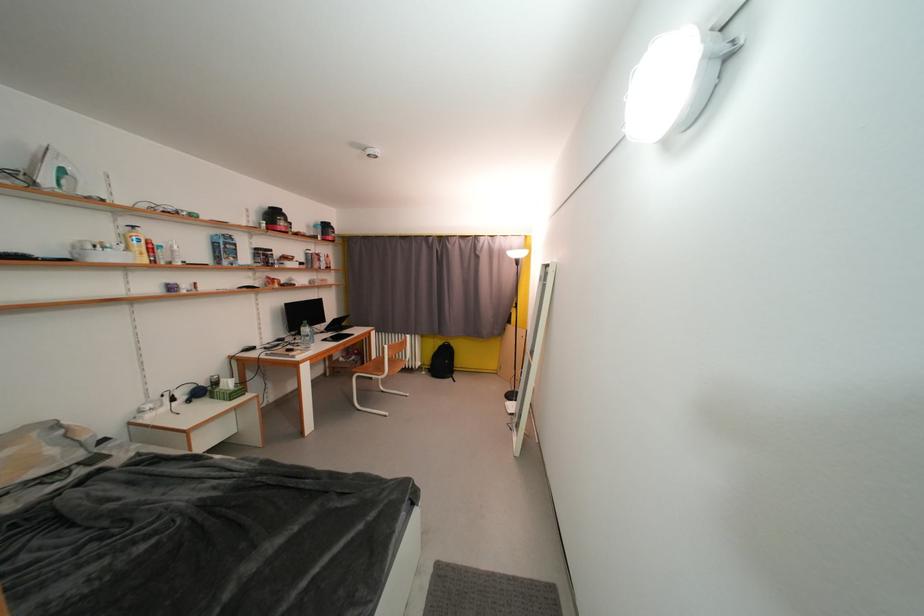
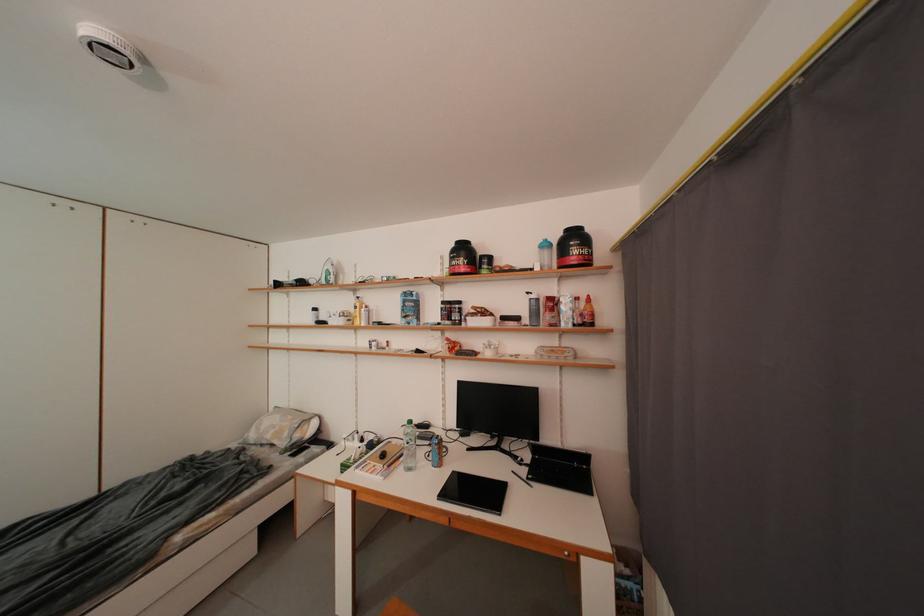
Locate, in the second image, the point that corresponds to (61,454) in the first image.

(294, 438)